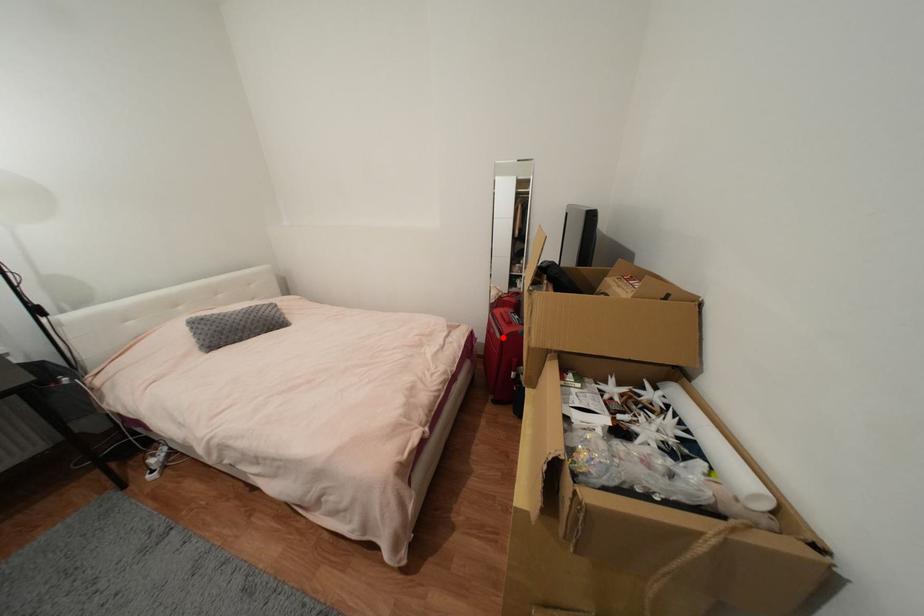
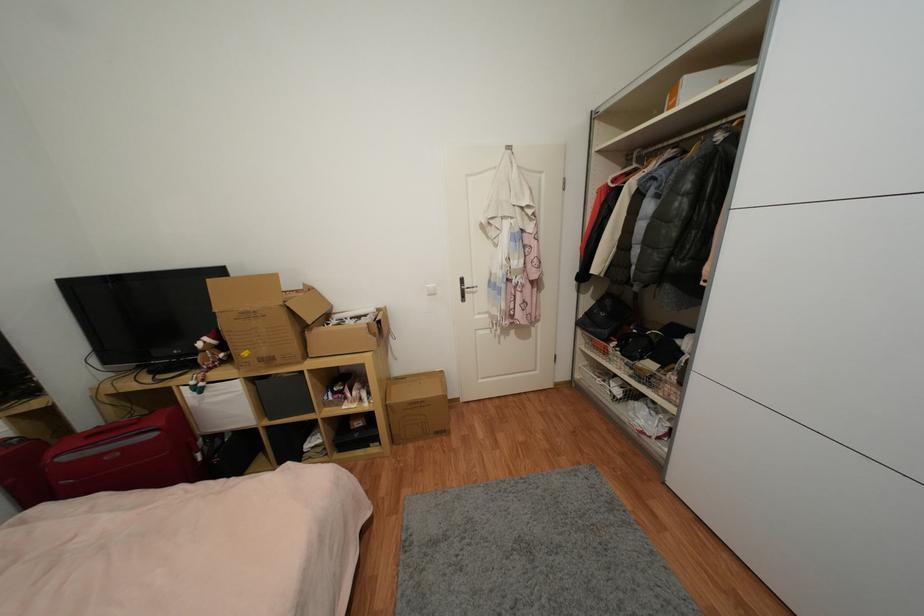
Question: I am providing you with two images of the same scene from different viewpoints. In image1, a red point is highlighted. Considering the same 3D point in image2, which of the following is correct?

Choices:
 (A) It is closer
 (B) It is farther

Answer: (B)